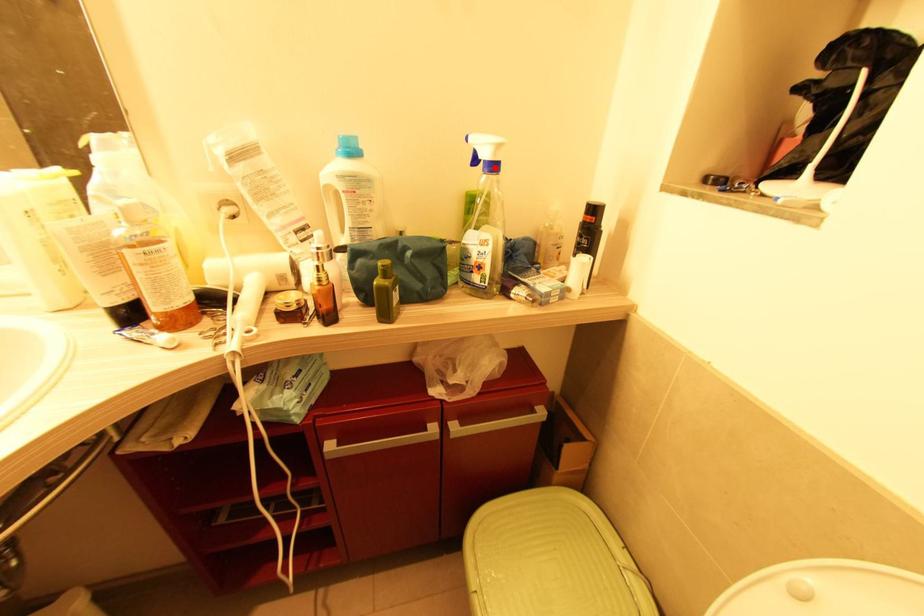
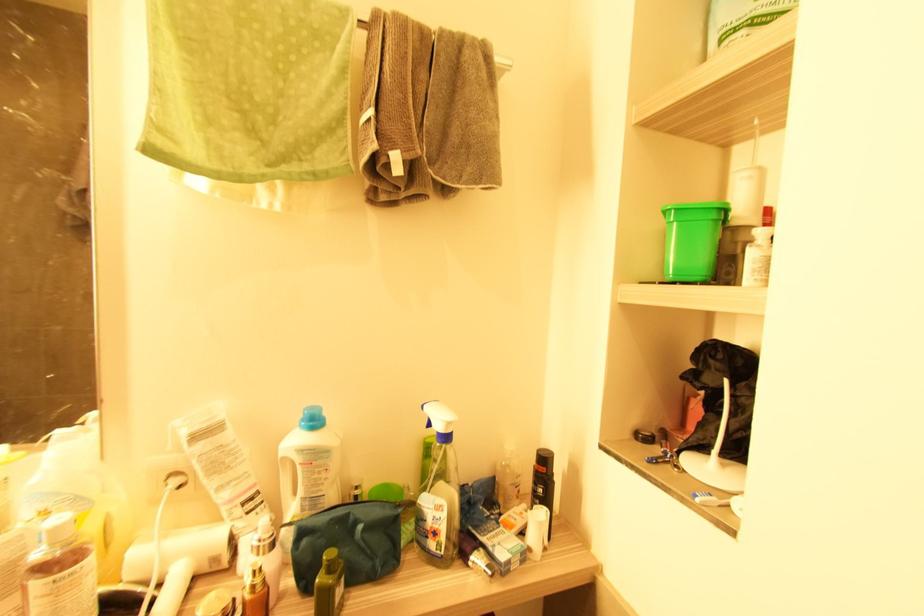
Question: I am providing you with two images of the same scene from different viewpoints. A red point is marked on the first image. At the location where the point appears in image 1, is it still visible in image 2?

Choices:
 (A) Yes
 (B) No

Answer: (A)